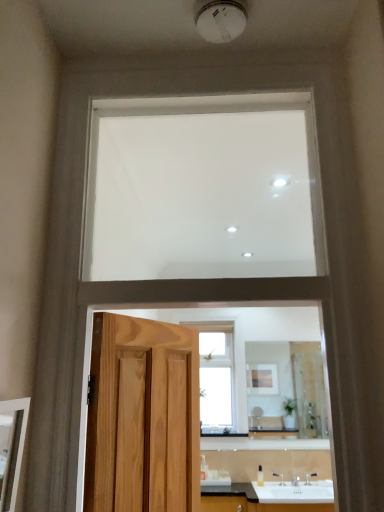
Question: In terms of width, does white glossy sink at lower center look wider or thinner when compared to white matte window at upper center, which ranks as the second window in back-to-front order?

Choices:
 (A) thin
 (B) wide

Answer: (B)

Question: Relative to white matte window at upper center, marked as the 2th window in a bottom-to-top arrangement, is white glossy sink at lower center in front or behind?

Choices:
 (A) front
 (B) behind

Answer: (B)

Question: Based on their relative distances, which object is farther from the matte wooden mirror at left, which is the 1th mirror in left-to-right order?

Choices:
 (A) clear glass window at center, acting as the second window starting from the front
 (B) white glossy sink at lower center
 (C) white matte window at upper center, the first window in the top-to-bottom sequence
 (D) clear glass mirror at center, the 2th mirror viewed from the left

Answer: (D)

Question: Which object is positioned closest to the clear glass mirror at center, which is counted as the 2th mirror, starting from the front?

Choices:
 (A) clear glass window at center, positioned as the 1th window in back-to-front order
 (B) white matte window at upper center, marked as the 2th window in a bottom-to-top arrangement
 (C) white glossy sink at lower center
 (D) matte wooden mirror at left, the 2th mirror in the back-to-front sequence

Answer: (A)